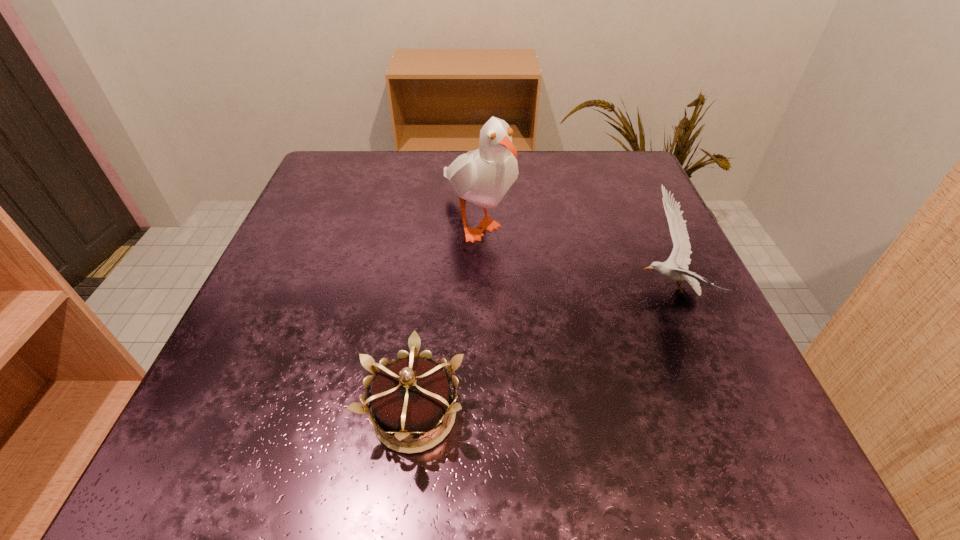
Where is `vacant space situated 0.100m on the back of the nearest object`? Image resolution: width=960 pixels, height=540 pixels. vacant space situated 0.100m on the back of the nearest object is located at coordinates (426, 314).

You are a GUI agent. You are given a task and a screenshot of the screen. Output one action in this format:
    pyautogui.click(x=<x>, y=<y>)
    Task: Click on the object at the far edge
    This screenshot has height=540, width=960.
    Given the screenshot: What is the action you would take?
    pyautogui.click(x=483, y=176)

Find the location of a particular element. The width and height of the screenshot is (960, 540). object located at the near edge is located at coordinates (411, 396).

Image resolution: width=960 pixels, height=540 pixels. Identify the location of object present at the right edge. (680, 256).

I want to click on vacant space at the far edge of the desktop, so click(x=557, y=161).

In the image, there is a desktop. At what (x,y) coordinates should I click in order to perform the action: click on free region at the near edge. Please return your answer as a coordinate pair (x, y). This screenshot has height=540, width=960. Looking at the image, I should click on (578, 452).

Find the location of a particular element. This screenshot has width=960, height=540. blank space at the left edge of the desktop is located at coordinates (370, 208).

Find the location of a particular element. This screenshot has width=960, height=540. vacant region at the right edge of the desktop is located at coordinates (702, 318).

Image resolution: width=960 pixels, height=540 pixels. I want to click on vacant position at the far left corner of the desktop, so click(x=357, y=162).

Locate an element on the screen. This screenshot has height=540, width=960. empty space between the nearest object and the right gull is located at coordinates (541, 353).